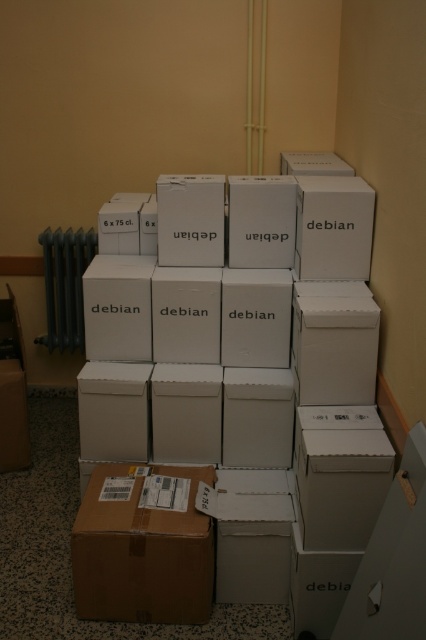
Does brown cardboard box at lower left have a greater width compared to black metal radiator at left?

Yes, brown cardboard box at lower left is wider than black metal radiator at left.

Consider the image. Does brown cardboard box at lower left lie in front of black metal radiator at left?

Yes, brown cardboard box at lower left is closer to the viewer.

Is point (109, 580) positioned after point (49, 314)?

No, (109, 580) is closer to viewer.

Where is `brown cardboard box at lower left`? brown cardboard box at lower left is located at coordinates (141, 554).

Does white cardboard box at center have a greater width compared to brown cardboard box at lower left?

Yes, white cardboard box at center is wider than brown cardboard box at lower left.

The height and width of the screenshot is (640, 426). What do you see at coordinates (250, 374) in the screenshot?
I see `white cardboard box at center` at bounding box center [250, 374].

Between point (94, 362) and point (192, 500), which one is positioned in front?

Positioned in front is point (192, 500).

The width and height of the screenshot is (426, 640). What are the coordinates of `white cardboard box at center` in the screenshot? It's located at (250, 374).

Is white cardboard box at center taller than black metal radiator at left?

Indeed, white cardboard box at center has a greater height compared to black metal radiator at left.

How distant is white cardboard box at center from black metal radiator at left?

A distance of 1.15 meters exists between white cardboard box at center and black metal radiator at left.

Does point (187, 204) come in front of point (75, 337)?

Yes, point (187, 204) is in front of point (75, 337).

Image resolution: width=426 pixels, height=640 pixels. What are the coordinates of `white cardboard box at center` in the screenshot? It's located at (250, 374).